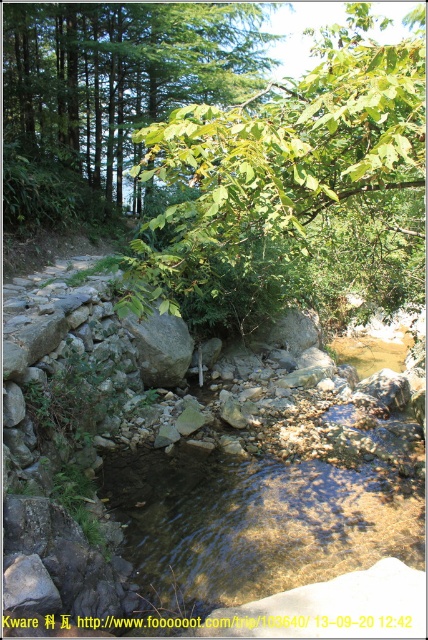
Question: Which point is farther to the camera?

Choices:
 (A) green leafy tree at center
 (B) green leafy tree at upper center

Answer: (B)

Question: Which of the following is the closest to the observer?

Choices:
 (A) green leafy tree at upper center
 (B) green leafy tree at center

Answer: (B)

Question: Among these objects, which one is farthest from the camera?

Choices:
 (A) green leafy tree at upper center
 (B) clear water at center

Answer: (A)

Question: Does clear water at center have a greater width compared to green leafy tree at upper center?

Choices:
 (A) no
 (B) yes

Answer: (A)

Question: From the image, what is the correct spatial relationship of clear water at center in relation to green leafy tree at upper center?

Choices:
 (A) right
 (B) left

Answer: (A)

Question: Is the position of green leafy tree at center less distant than that of green leafy tree at upper center?

Choices:
 (A) no
 (B) yes

Answer: (B)